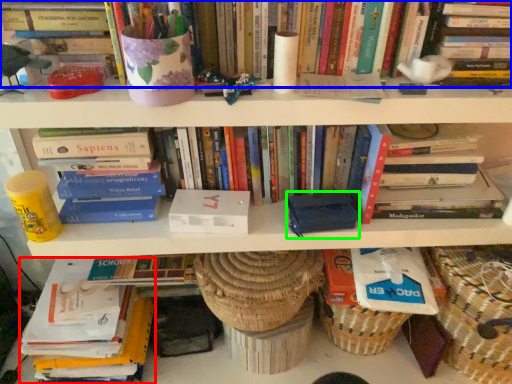
Question: Considering the real-world distances, which object is farthest from book (highlighted by a red box)? book (highlighted by a blue box) or paperback book (highlighted by a green box)?

Choices:
 (A) book
 (B) paperback book

Answer: (A)